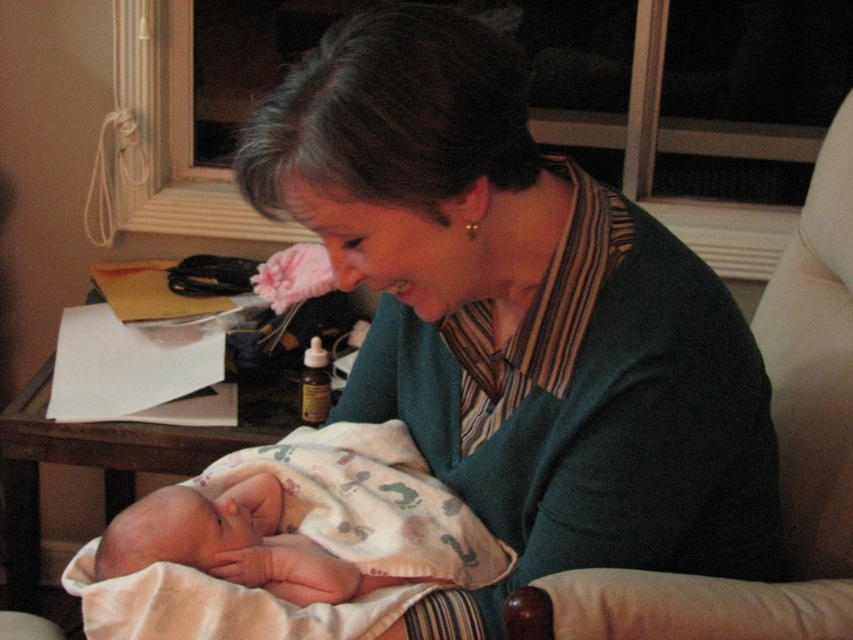
You are a delivery drone trying to drop a small package at point [428,152]. The minimum safe distance for landing is 30 inches. Can you land safely?

The distance of point [428,152] from camera is 31.77 inches, so the drone can land safely since the distance is more than the minimum required 30 inches.

You are an interior designer planning to place a small plant on the table next to the point marked at coordinates (779, 461). Based on the scene description, can you confirm if there is enough space on the table for the plant?

The point marked at coordinates (779, 461) corresponds to the white fabric armchair at right. Since the table is described as having various items including papers, a pen, a small bottle, and a pink object, there may not be sufficient space for an additional plant unless some items are rearranged.

You are designing a room layout and need to place a large sofa that is 2 meters wide. You have the matte green sweater at center and the white fabric armchair at right in the room. Which object should you move to accommodate the sofa?

The matte green sweater at center is larger in size than the white fabric armchair at right, so you should move the matte green sweater at center to accommodate the sofa.